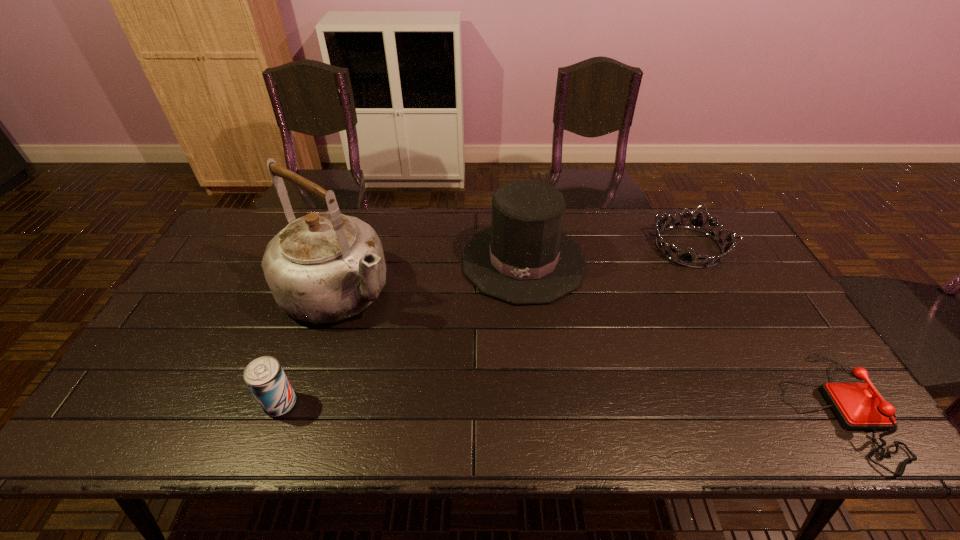
The image size is (960, 540). Identify the location of vacant space on the desktop that is between the beer can and the telephone and is positioned on the front-facing side of the tiara. (638, 407).

Locate an element on the screen. The height and width of the screenshot is (540, 960). vacant space on the desktop that is between the third shortest object and the telephone and is positioned at the spout of the kettle is located at coordinates (x=509, y=406).

Identify the location of free spot on the desktop that is between the third shortest object and the telephone and is positioned on the front of the dress hat with the decoration. (495, 406).